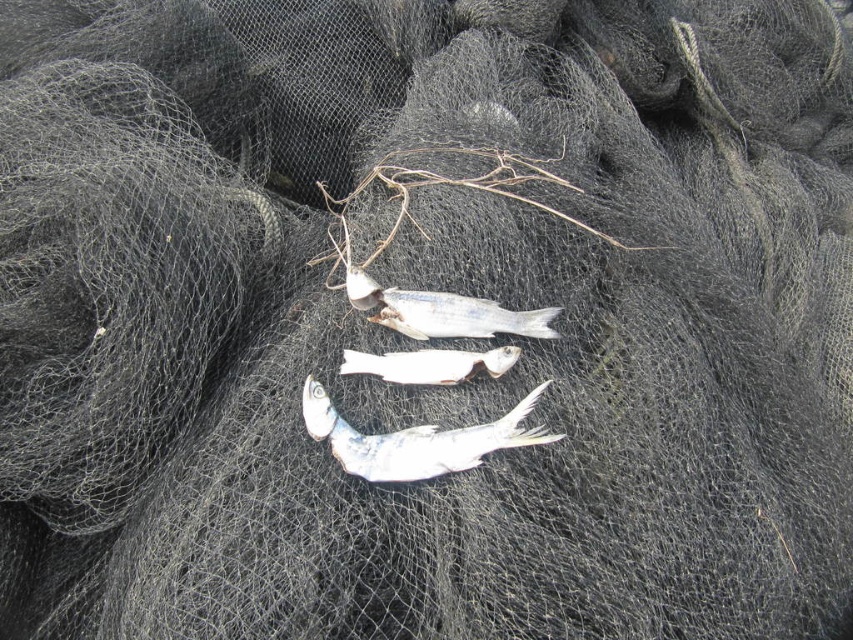
Question: Is brown/dry wood at center positioned in front of white matte fish at center?

Choices:
 (A) no
 (B) yes

Answer: (A)

Question: Is brown/dry wood at center closer to camera compared to white glossy fish at center?

Choices:
 (A) no
 (B) yes

Answer: (A)

Question: Is white matte fish at center wider than white glossy fish at center?

Choices:
 (A) no
 (B) yes

Answer: (B)

Question: Which is nearer to the white matte fish at center?

Choices:
 (A) brown/dry wood at center
 (B) white glossy fish at center

Answer: (B)

Question: Which point is closer to the camera?

Choices:
 (A) brown/dry wood at center
 (B) white matte fish at center
 (C) white glossy fish at center
 (D) shiny silver fish at center

Answer: (D)

Question: Which object is closer to the camera taking this photo?

Choices:
 (A) white matte fish at center
 (B) white glossy fish at center
 (C) brown/dry wood at center

Answer: (B)